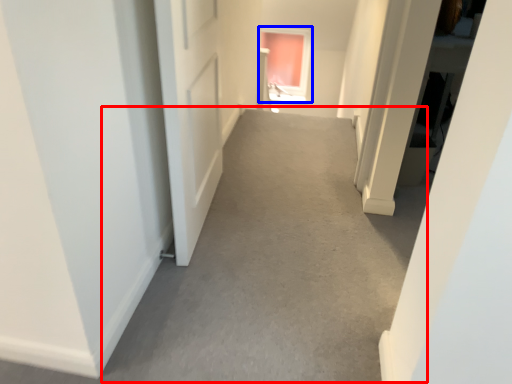
Question: Which object appears closest to the camera in this image, alley (highlighted by a red box) or window (highlighted by a blue box)?

Choices:
 (A) alley
 (B) window

Answer: (A)